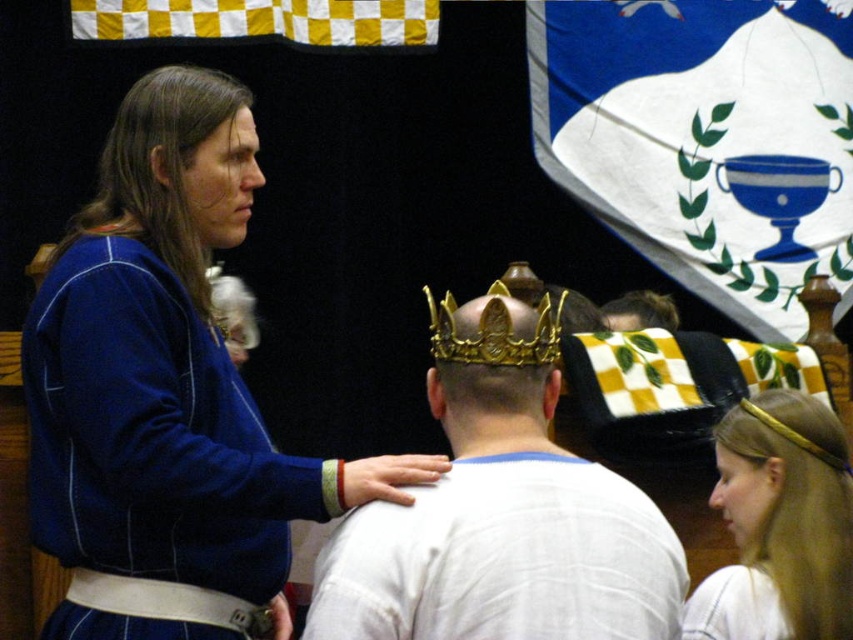
What do you see at coordinates (502, 513) in the screenshot? I see `gold metallic crown at center` at bounding box center [502, 513].

Can you confirm if gold metallic crown at center is taller than golden hairband at upper right?

Correct, gold metallic crown at center is much taller as golden hairband at upper right.

Is point (614, 545) more distant than point (820, 564)?

No, (614, 545) is closer to viewer.

The image size is (853, 640). I want to click on gold metallic crown at center, so click(x=502, y=513).

Does blue fabric flag at upper right have a lesser height compared to blue fleece robe at upper left?

In fact, blue fabric flag at upper right may be taller than blue fleece robe at upper left.

This screenshot has height=640, width=853. What do you see at coordinates (706, 140) in the screenshot? I see `blue fabric flag at upper right` at bounding box center [706, 140].

At what (x,y) coordinates should I click in order to perform the action: click on blue fabric flag at upper right. Please return your answer as a coordinate pair (x, y). This screenshot has height=640, width=853. Looking at the image, I should click on (706, 140).

Consider the image. Can you confirm if blue fleece robe at upper left is positioned to the left of golden hairband at upper right?

Correct, you'll find blue fleece robe at upper left to the left of golden hairband at upper right.

Is blue fleece robe at upper left in front of golden hairband at upper right?

Yes, blue fleece robe at upper left is closer to the viewer.

Which is behind, point (112, 294) or point (762, 614)?

The point (762, 614) is more distant.

Image resolution: width=853 pixels, height=640 pixels. In order to click on blue fleece robe at upper left in this screenshot , I will do `click(154, 435)`.